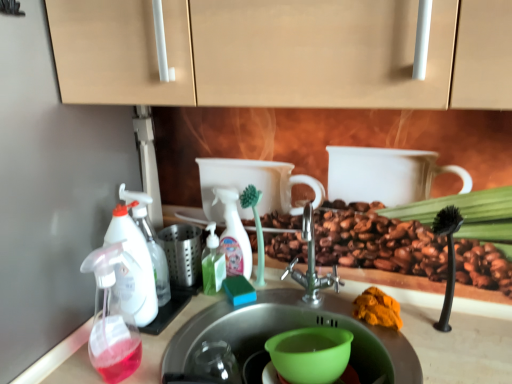
The width and height of the screenshot is (512, 384). I want to click on empty space that is to the right of translucent plastic spray bottle at left, which appears as the 2th soap dispenser when viewed from the left, so click(172, 356).